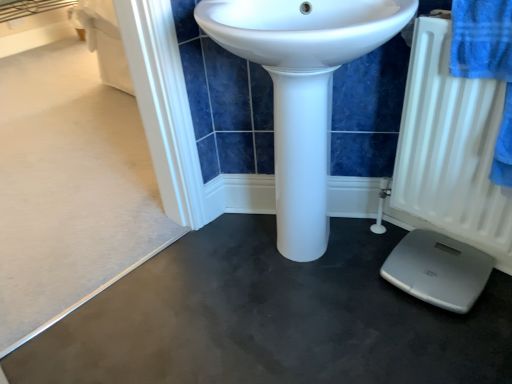
Locate an element on the screen. vacant space situated on the left part of white glossy sink at center is located at coordinates (183, 290).